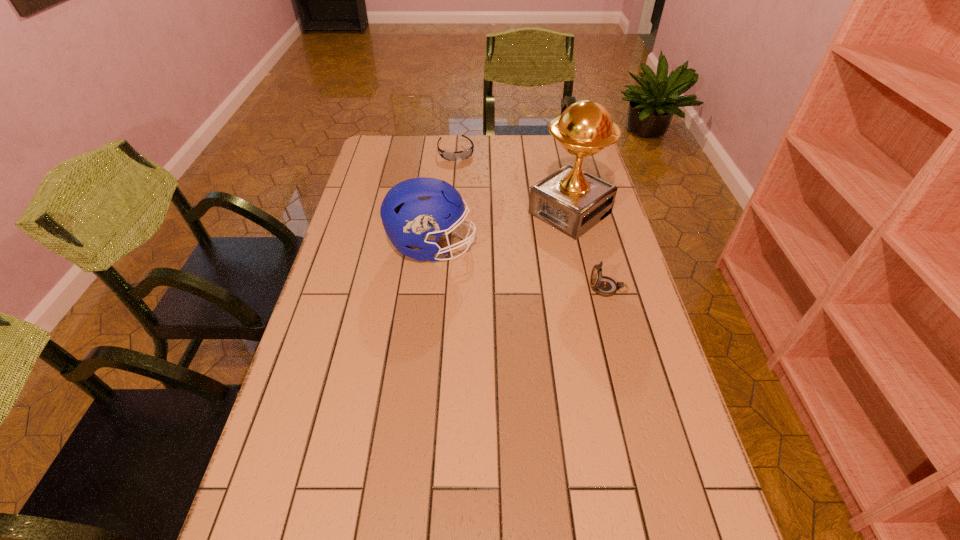
In order to click on free space at the far edge in this screenshot , I will do `click(510, 163)`.

You are a GUI agent. You are given a task and a screenshot of the screen. Output one action in this format:
    pyautogui.click(x=<x>, y=<y>)
    Task: Click on the free spot at the near edge of the desktop
    
    Given the screenshot: What is the action you would take?
    pyautogui.click(x=527, y=519)

Find the location of a particular element. vacant space at the left edge of the desktop is located at coordinates (358, 364).

This screenshot has height=540, width=960. I want to click on vacant space at the right edge of the desktop, so click(661, 357).

Find the location of a particular element. The height and width of the screenshot is (540, 960). free space at the far left corner is located at coordinates (396, 138).

This screenshot has width=960, height=540. Find the location of `vacant space in between the nearest object and the sunglasses`. vacant space in between the nearest object and the sunglasses is located at coordinates (532, 220).

Identify the location of empty space that is in between the sunglasses and the award. (513, 183).

Find the location of a particular element. The width and height of the screenshot is (960, 540). empty space between the second shortest object and the football helmet is located at coordinates (520, 268).

Locate an element on the screen. free area in between the football helmet and the award is located at coordinates (501, 230).

Locate an element on the screen. Image resolution: width=960 pixels, height=540 pixels. free space between the award and the third tallest object is located at coordinates (589, 251).